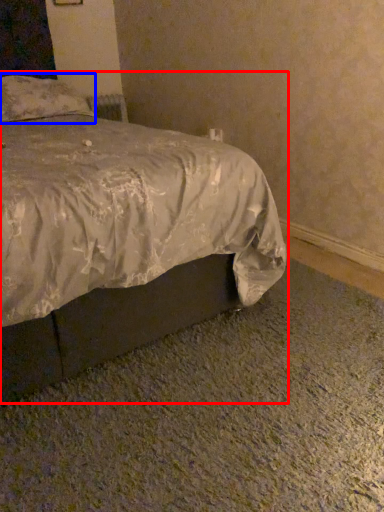
Question: Among these objects, which one is farthest to the camera, bed (highlighted by a red box) or pillow (highlighted by a blue box)?

Choices:
 (A) bed
 (B) pillow

Answer: (B)